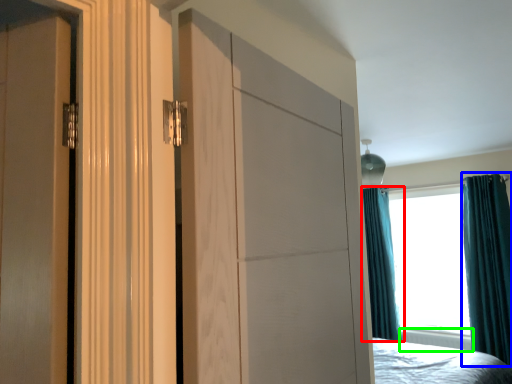
Question: Which object is positioned closest to curtain (highlighted by a red box)? Select from curtain (highlighted by a blue box) and radiator (highlighted by a green box).

Choices:
 (A) curtain
 (B) radiator

Answer: (B)